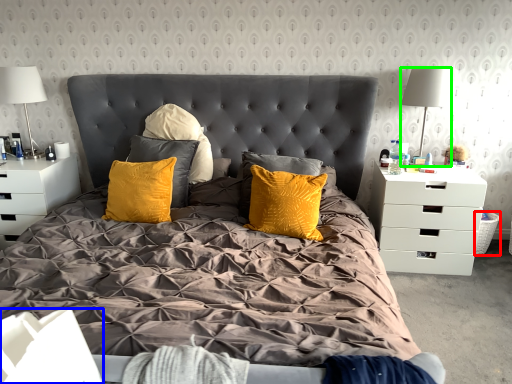
Question: Which is nearer to the picnic basket (highlighted by a red box)? box (highlighted by a blue box) or lamp (highlighted by a green box).

Choices:
 (A) box
 (B) lamp

Answer: (B)